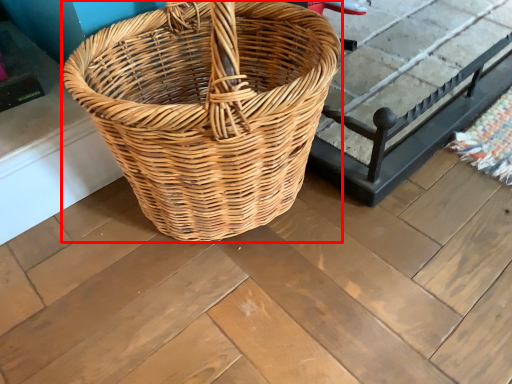
Question: From the image, what is the correct spatial relationship of picnic basket (annotated by the red box) in relation to table?

Choices:
 (A) right
 (B) left

Answer: (B)